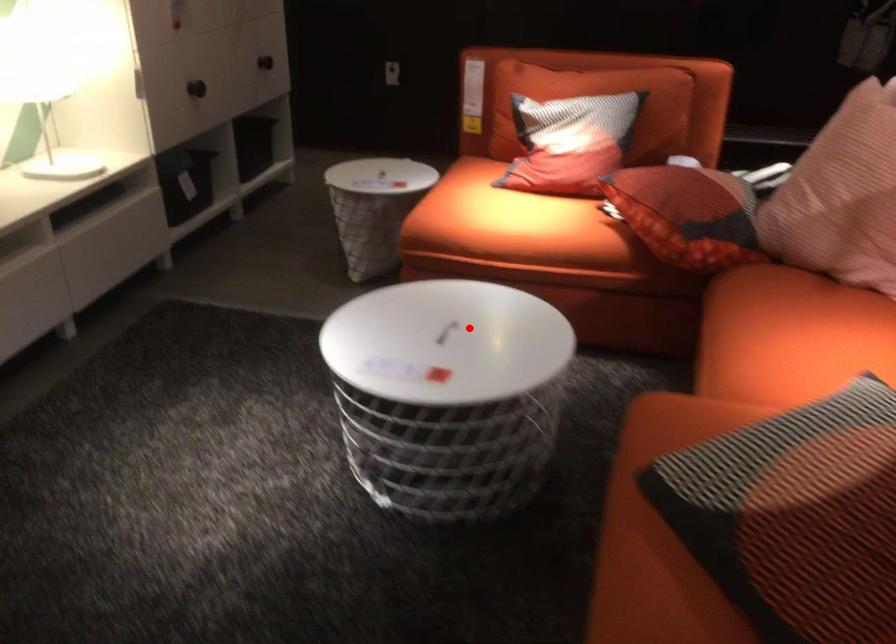
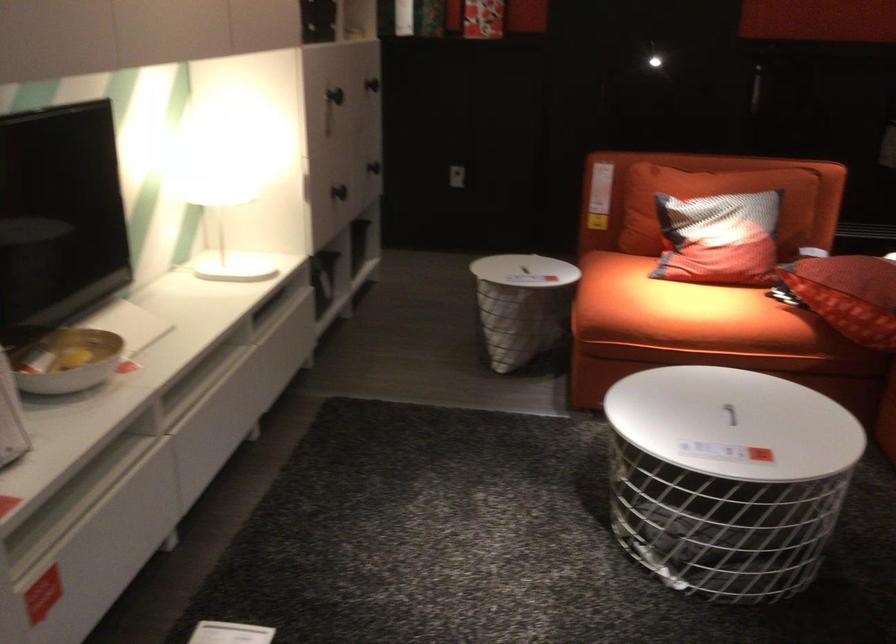
In the second image, find the point that corresponds to the highlighted location in the first image.

(729, 413)